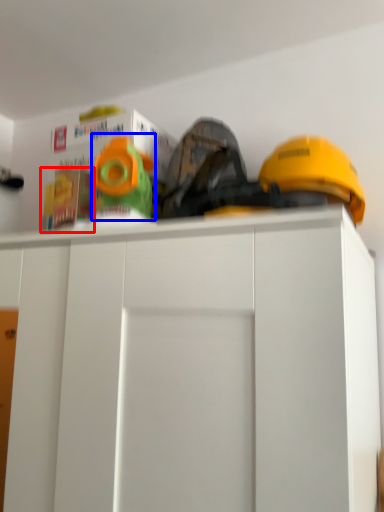
Question: Among these objects, which one is farthest to the camera, toy (highlighted by a red box) or toy (highlighted by a blue box)?

Choices:
 (A) toy
 (B) toy

Answer: (A)